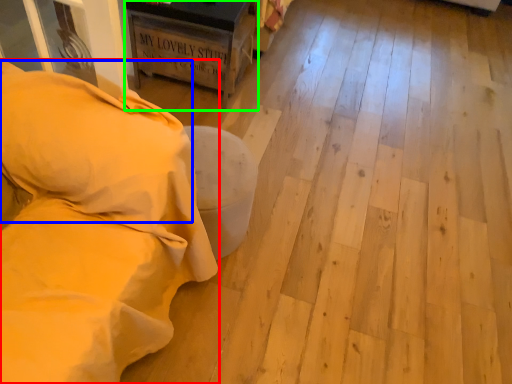
Question: Which object is the closest to the furniture (highlighted by a red box)? Choose among these: pillow (highlighted by a blue box) or furniture (highlighted by a green box).

Choices:
 (A) pillow
 (B) furniture

Answer: (A)